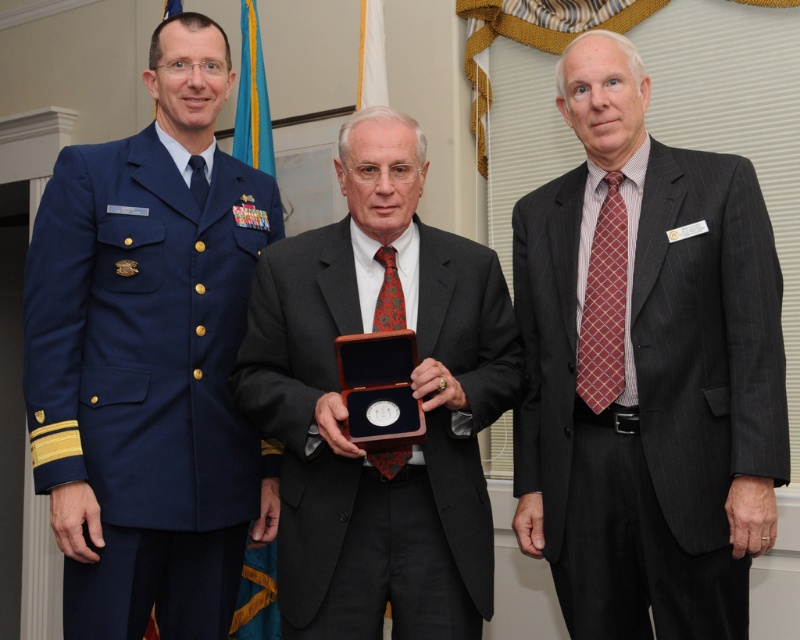
Who is positioned more to the left, dark gray pinstripe suit at right or blue fabric uniform at left?

From the viewer's perspective, blue fabric uniform at left appears more on the left side.

Between dark gray pinstripe suit at right and blue fabric uniform at left, which one has less height?

With less height is dark gray pinstripe suit at right.

Who is more forward, [592,378] or [126,408]?

Point [592,378]

This screenshot has width=800, height=640. I want to click on dark gray pinstripe suit at right, so click(648, 388).

Which of these two, blue fabric uniform at left or matte black suit at center, stands shorter?

matte black suit at center is shorter.

Does point (194, 273) come closer to viewer compared to point (314, 285)?

No, it is behind (314, 285).

The height and width of the screenshot is (640, 800). Describe the element at coordinates (146, 372) in the screenshot. I see `blue fabric uniform at left` at that location.

I want to click on blue fabric uniform at left, so click(x=146, y=372).

Find the location of `dark gray pinstripe suit at right`. dark gray pinstripe suit at right is located at coordinates (648, 388).

Between dark gray pinstripe suit at right and matte black suit at center, which one is positioned higher?

dark gray pinstripe suit at right is higher up.

Measure the distance between dark gray pinstripe suit at right and camera.

They are 5.86 feet apart.

This screenshot has height=640, width=800. Identify the location of dark gray pinstripe suit at right. (648, 388).